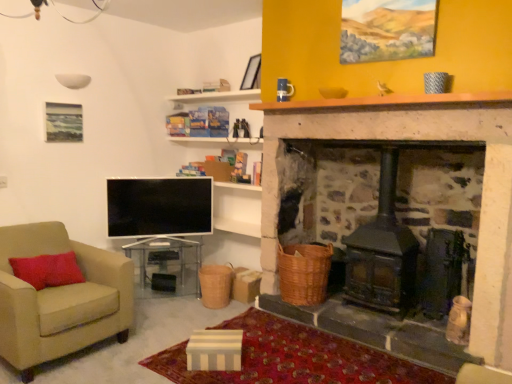
Question: Considering the relative sizes of matte black picture frame at upper center and braided wicker basket at center, which ranks as the 1th basket in left-to-right order, in the image provided, is matte black picture frame at upper center thinner than braided wicker basket at center, which ranks as the 1th basket in left-to-right order,?

Choices:
 (A) no
 (B) yes

Answer: (B)

Question: Are matte black picture frame at upper center and braided wicker basket at center, which ranks as the 1th basket in left-to-right order, far apart?

Choices:
 (A) no
 (B) yes

Answer: (B)

Question: Does matte black picture frame at upper center have a greater height compared to braided wicker basket at center, which is counted as the second basket, starting from the right?

Choices:
 (A) no
 (B) yes

Answer: (B)

Question: From a real-world perspective, is matte black picture frame at upper center physically below braided wicker basket at center, which ranks as the 1th basket in left-to-right order?

Choices:
 (A) yes
 (B) no

Answer: (B)

Question: From a real-world perspective, is matte black picture frame at upper center over braided wicker basket at center, which ranks as the 1th basket in left-to-right order?

Choices:
 (A) no
 (B) yes

Answer: (B)

Question: Based on their sizes in the image, would you say flat screen tv at lower left is bigger or smaller than brown wooden mantle at upper center?

Choices:
 (A) big
 (B) small

Answer: (A)

Question: From their relative heights in the image, would you say flat screen tv at lower left is taller or shorter than brown wooden mantle at upper center?

Choices:
 (A) tall
 (B) short

Answer: (A)

Question: From the image's perspective, is flat screen tv at lower left located above or below brown wooden mantle at upper center?

Choices:
 (A) below
 (B) above

Answer: (A)

Question: Visually, is flat screen tv at lower left positioned to the left or to the right of brown wooden mantle at upper center?

Choices:
 (A) right
 (B) left

Answer: (B)

Question: Considering the positions of beige fabric armchair at left and clear glass table at center in the image, is beige fabric armchair at left wider or thinner than clear glass table at center?

Choices:
 (A) wide
 (B) thin

Answer: (A)

Question: Considering the positions of beige fabric armchair at left and clear glass table at center in the image, is beige fabric armchair at left taller or shorter than clear glass table at center?

Choices:
 (A) short
 (B) tall

Answer: (B)

Question: Would you say beige fabric armchair at left is to the left or to the right of clear glass table at center in the picture?

Choices:
 (A) left
 (B) right

Answer: (A)

Question: From the image's perspective, is beige fabric armchair at left positioned above or below clear glass table at center?

Choices:
 (A) above
 (B) below

Answer: (A)

Question: From the image's perspective, is braided wicker basket at center, which ranks as the 1th basket in left-to-right order, above or below brown wooden mantle at upper center?

Choices:
 (A) above
 (B) below

Answer: (B)

Question: From a real-world perspective, is braided wicker basket at center, which ranks as the 1th basket in left-to-right order, physically located above or below brown wooden mantle at upper center?

Choices:
 (A) below
 (B) above

Answer: (A)